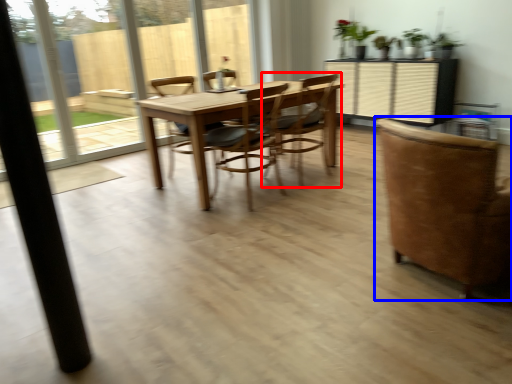
Question: Which point is closer to the camera, chair (highlighted by a red box) or chair (highlighted by a blue box)?

Choices:
 (A) chair
 (B) chair

Answer: (B)